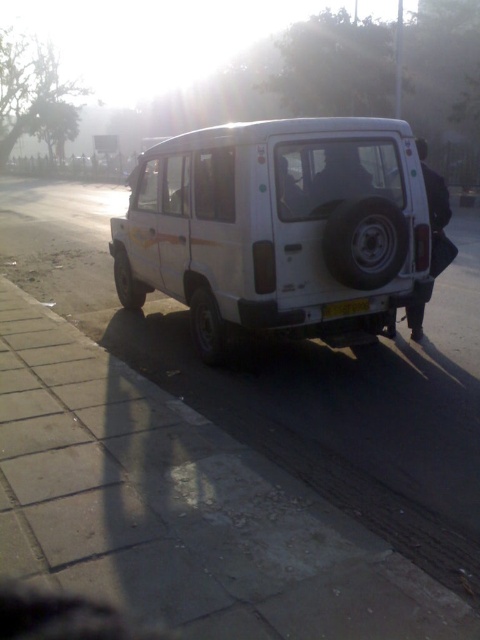
Question: Which object is positioned closest to the yellow plastic license plate at rear?

Choices:
 (A) white matte van at center
 (B) gray concrete pavement at center

Answer: (A)

Question: Does white matte van at center appear on the right side of yellow plastic license plate at rear?

Choices:
 (A) yes
 (B) no

Answer: (A)

Question: Based on their relative distances, which object is farther from the white matte van at center?

Choices:
 (A) yellow plastic license plate at rear
 (B) gray concrete pavement at center

Answer: (B)

Question: Does white matte van at center appear on the left side of yellow plastic license plate at rear?

Choices:
 (A) no
 (B) yes

Answer: (A)

Question: Is white matte van at center bigger than yellow plastic license plate at rear?

Choices:
 (A) yes
 (B) no

Answer: (A)

Question: Which object is the closest to the gray concrete pavement at center?

Choices:
 (A) white matte van at center
 (B) yellow plastic license plate at rear

Answer: (B)